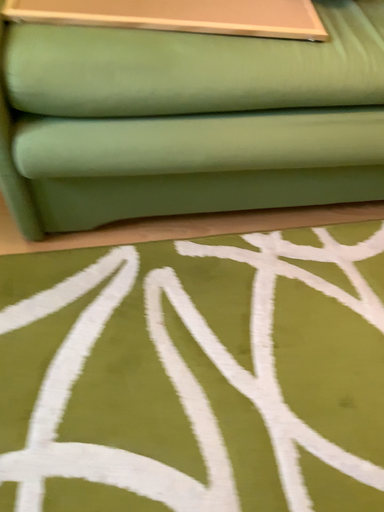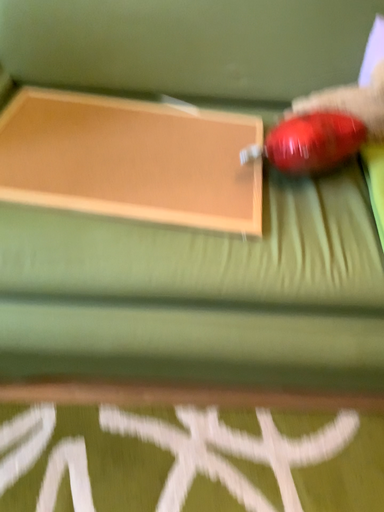
Question: Which way did the camera rotate in the video?

Choices:
 (A) rotated downward
 (B) rotated upward

Answer: (B)